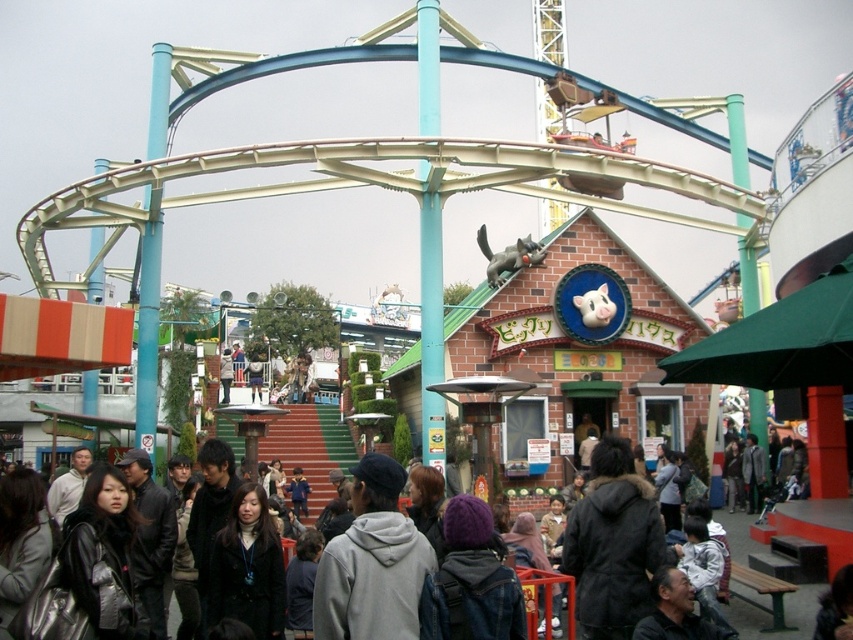
Describe the element at coordinates (372, 563) in the screenshot. I see `gray hoodie at center` at that location.

Locate an element on the screen. This screenshot has height=640, width=853. gray hoodie at center is located at coordinates (372, 563).

What do you see at coordinates (372, 563) in the screenshot? I see `gray hoodie at center` at bounding box center [372, 563].

You are a GUI agent. You are given a task and a screenshot of the screen. Output one action in this format:
    pyautogui.click(x=<x>, y=<y>)
    Task: Click on the gray hoodie at center
    
    Given the screenshot: What is the action you would take?
    pyautogui.click(x=372, y=563)